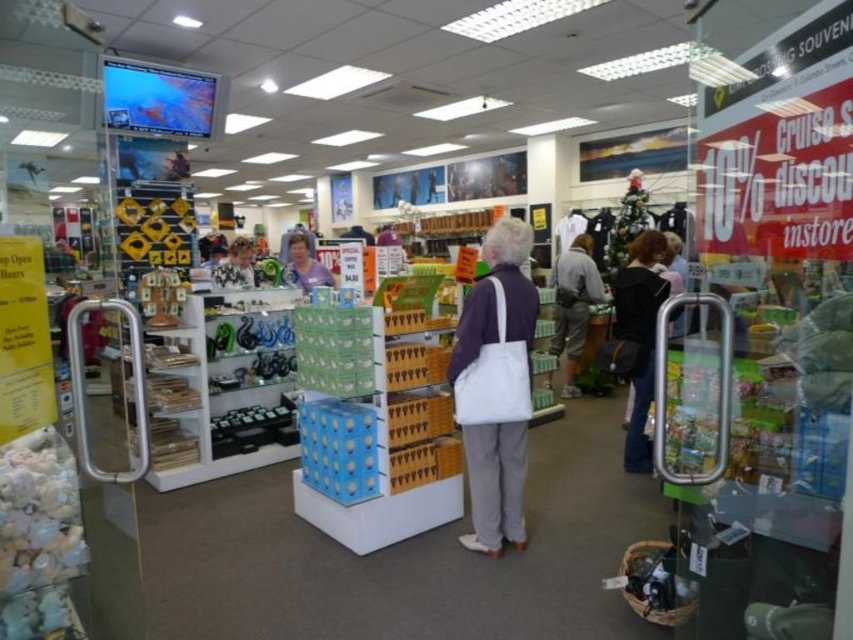
You are a store employee arranging items on a shelf. You have a white canvas tote bag at center and a black fabric purse at center. Which item should you place first if you want to maximize shelf space efficiency?

You should place the white canvas tote bag at center first because it occupies less space than the black fabric purse at center, allowing more room for other items.

You are standing in the retail store and need to locate the black fabric purse at center. According to the store layout, where would you find it?

The black fabric purse at center is located at the coordinates 0.522 on the x axis and 0.751 on the y axis in the store layout.

You are a customer in the store and want to pick up both the white canvas tote bag at center and the black fabric purse at center. Which one is located to the left side of the other?

The white canvas tote bag at center is to the left of the black fabric purse at center.